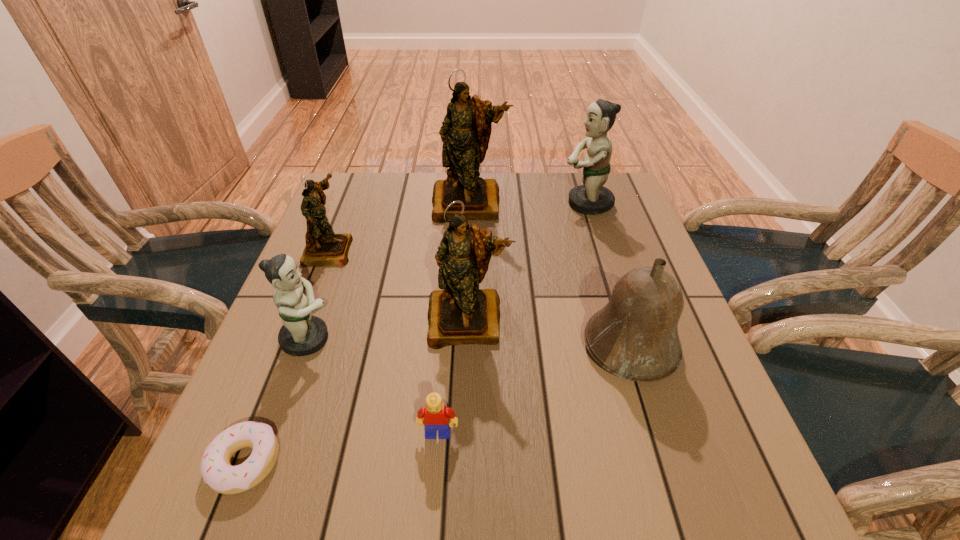
Locate an element on the screen. free space located on the front-facing side of the smaller green figurine is located at coordinates (431, 339).

Locate an element on the screen. This screenshot has width=960, height=540. vacant space located on the face of the Lego is located at coordinates (435, 482).

The height and width of the screenshot is (540, 960). I want to click on vacant space situated on the back of the doughnut, so click(x=308, y=302).

At what (x,y) coordinates should I click in order to perform the action: click on object at the near edge. Please return your answer as a coordinate pair (x, y). Looking at the image, I should click on (222, 477).

I want to click on doughnut that is at the left edge, so click(x=222, y=477).

Identify the location of figurine at the right edge. (592, 197).

You are a GUI agent. You are given a task and a screenshot of the screen. Output one action in this format:
    pyautogui.click(x=<x>, y=<y>)
    Task: Click on the bell positioned at the right edge
    The height and width of the screenshot is (540, 960).
    Given the screenshot: What is the action you would take?
    pyautogui.click(x=635, y=336)

Find the location of `object that is at the near left corner`. object that is at the near left corner is located at coordinates (222, 477).

Find the location of a particular element. This screenshot has width=960, height=540. object that is at the far right corner is located at coordinates (592, 197).

Image resolution: width=960 pixels, height=540 pixels. In order to click on vacant area at the far edge in this screenshot , I will do `click(432, 180)`.